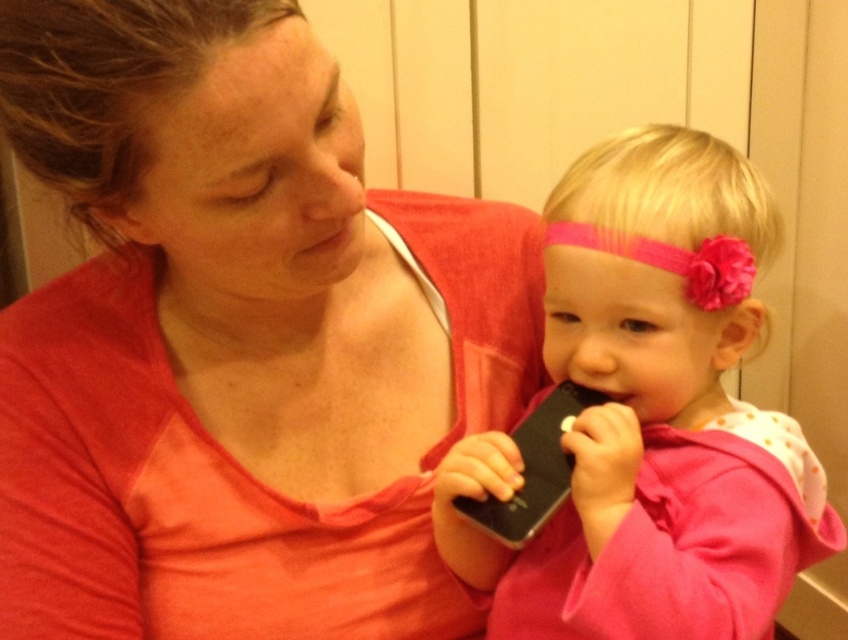
Question: Is matte pink shirt at center bigger than pink matte phone at center?

Choices:
 (A) no
 (B) yes

Answer: (B)

Question: Which object is closer to the camera taking this photo?

Choices:
 (A) pink matte phone at center
 (B) matte pink shirt at center

Answer: (B)

Question: Can you confirm if matte pink shirt at center is positioned below pink matte phone at center?

Choices:
 (A) no
 (B) yes

Answer: (A)

Question: Which of the following is the farthest from the observer?

Choices:
 (A) matte pink shirt at center
 (B) pink matte phone at center

Answer: (B)

Question: Is matte pink shirt at center smaller than pink matte phone at center?

Choices:
 (A) no
 (B) yes

Answer: (A)